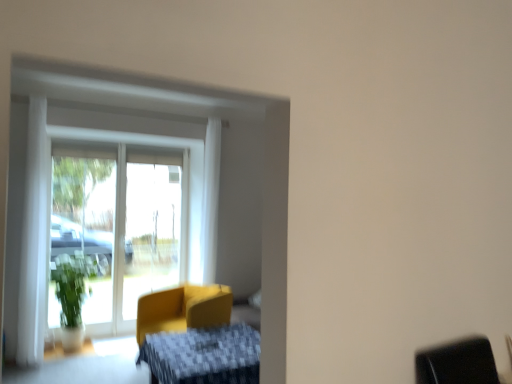
Where is `matte yellow armchair at center`? The image size is (512, 384). matte yellow armchair at center is located at coordinates (183, 309).

What do you see at coordinates (183, 309) in the screenshot?
I see `matte yellow armchair at center` at bounding box center [183, 309].

Measure the distance between point (x=212, y=383) and camera.

A distance of 2.89 meters exists between point (x=212, y=383) and camera.

This screenshot has width=512, height=384. I want to click on textured yellow armchair at center, so click(x=203, y=356).

Image resolution: width=512 pixels, height=384 pixels. Describe the element at coordinates (203, 356) in the screenshot. I see `textured yellow armchair at center` at that location.

Locate an element on the screen. matte yellow armchair at center is located at coordinates (183, 309).

Which is more to the left, textured yellow armchair at center or matte yellow armchair at center?

From the viewer's perspective, matte yellow armchair at center appears more on the left side.

Which object is more forward, textured yellow armchair at center or matte yellow armchair at center?

Positioned in front is textured yellow armchair at center.

Which is behind, point (190, 376) or point (210, 295)?

The point (210, 295) is behind.

From the image's perspective, is textured yellow armchair at center above matte yellow armchair at center?

No.

From a real-world perspective, is textured yellow armchair at center located beneath matte yellow armchair at center?

Yes, from a real-world perspective, textured yellow armchair at center is below matte yellow armchair at center.

Between textured yellow armchair at center and matte yellow armchair at center, which one has larger width?

Wider between the two is textured yellow armchair at center.

Between textured yellow armchair at center and matte yellow armchair at center, which one has more height?

matte yellow armchair at center.

Considering the relative sizes of textured yellow armchair at center and matte yellow armchair at center in the image provided, is textured yellow armchair at center smaller than matte yellow armchair at center?

Yes.

Is textured yellow armchair at center not inside matte yellow armchair at center?

Indeed, textured yellow armchair at center is completely outside matte yellow armchair at center.

Does textured yellow armchair at center touch matte yellow armchair at center?

No, textured yellow armchair at center is not with matte yellow armchair at center.

Does textured yellow armchair at center turn towards matte yellow armchair at center?

No, textured yellow armchair at center does not turn towards matte yellow armchair at center.

How many degrees apart are the facing directions of textured yellow armchair at center and matte yellow armchair at center?

The facing directions of textured yellow armchair at center and matte yellow armchair at center are 30.6 degrees apart.

You are a GUI agent. You are given a task and a screenshot of the screen. Output one action in this format:
    pyautogui.click(x=<x>, y=<y>)
    Task: Click on the furniture beneath the matte yellow armchair at center (from a real-world perspective)
    This screenshot has width=512, height=384.
    Given the screenshot: What is the action you would take?
    pyautogui.click(x=203, y=356)

Which object is positioned more to the right, matte yellow armchair at center or textured yellow armchair at center?

textured yellow armchair at center is more to the right.

Between matte yellow armchair at center and textured yellow armchair at center, which one is positioned in front?

textured yellow armchair at center is closer to the camera.

Is point (187, 316) closer or farther from the camera than point (174, 338)?

Point (187, 316) is positioned farther from the camera compared to point (174, 338).

From the image's perspective, is matte yellow armchair at center over textured yellow armchair at center?

Yes, from the image's perspective, matte yellow armchair at center is over textured yellow armchair at center.

From a real-world perspective, between matte yellow armchair at center and textured yellow armchair at center, who is vertically lower?

In real-world perspective, textured yellow armchair at center is lower.

Looking at their sizes, would you say matte yellow armchair at center is wider or thinner than textured yellow armchair at center?

Clearly, matte yellow armchair at center has less width compared to textured yellow armchair at center.

Considering the sizes of matte yellow armchair at center and textured yellow armchair at center in the image, is matte yellow armchair at center taller or shorter than textured yellow armchair at center?

In the image, matte yellow armchair at center appears to be taller than textured yellow armchair at center.

Who is bigger, matte yellow armchair at center or textured yellow armchair at center?

matte yellow armchair at center.

Would you say matte yellow armchair at center is inside or outside textured yellow armchair at center?

The correct answer is: outside.

Is matte yellow armchair at center not close to textured yellow armchair at center?

No, matte yellow armchair at center is not far away from textured yellow armchair at center.

Is matte yellow armchair at center turned away from textured yellow armchair at center?

No, matte yellow armchair at center is not facing away from textured yellow armchair at center.

How different are the orientations of matte yellow armchair at center and textured yellow armchair at center in degrees?

30.6 degrees.

How far apart are matte yellow armchair at center and textured yellow armchair at center?

matte yellow armchair at center and textured yellow armchair at center are 25.77 inches apart from each other.

Where is `furniture that appears in front of the matte yellow armchair at center`? furniture that appears in front of the matte yellow armchair at center is located at coordinates (203, 356).

Where is `furniture on the right of matte yellow armchair at center`? This screenshot has width=512, height=384. furniture on the right of matte yellow armchair at center is located at coordinates (203, 356).

This screenshot has width=512, height=384. There is a textured yellow armchair at center. What are the coordinates of `chair above it (from a real-world perspective)` in the screenshot? It's located at (183, 309).